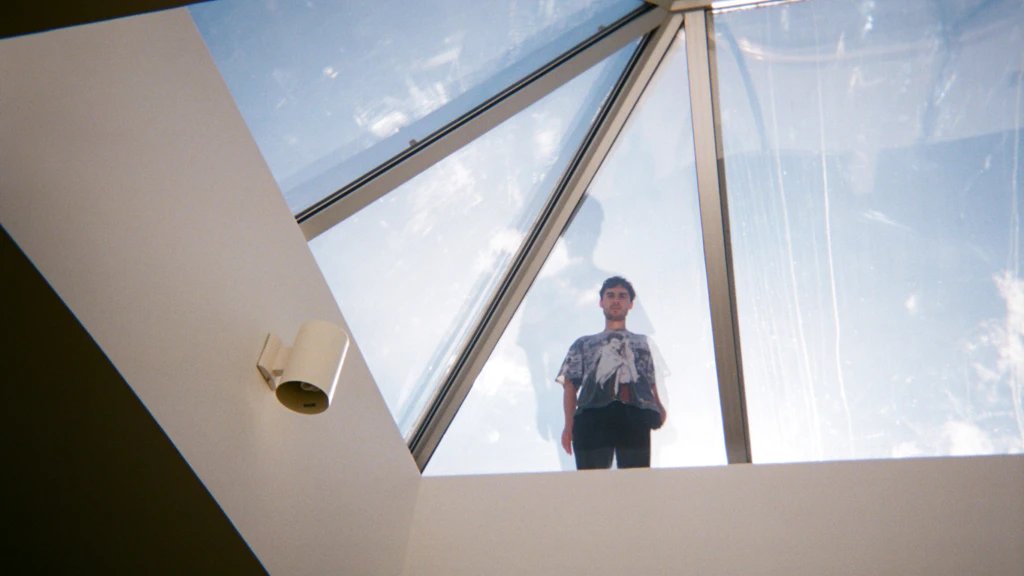
Where is `metal frame`? metal frame is located at coordinates (352, 196).